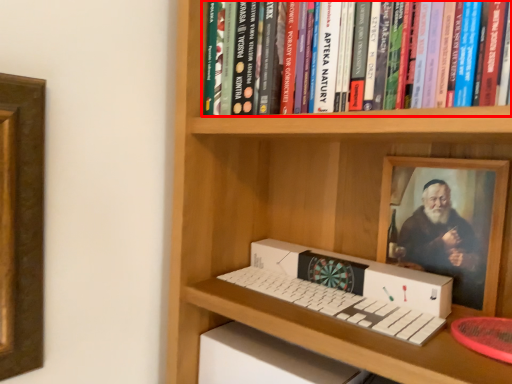
Question: From the image's perspective, considering the relative positions of book (annotated by the red box) and box in the image provided, where is book (annotated by the red box) located with respect to the staircase?

Choices:
 (A) above
 (B) below

Answer: (A)